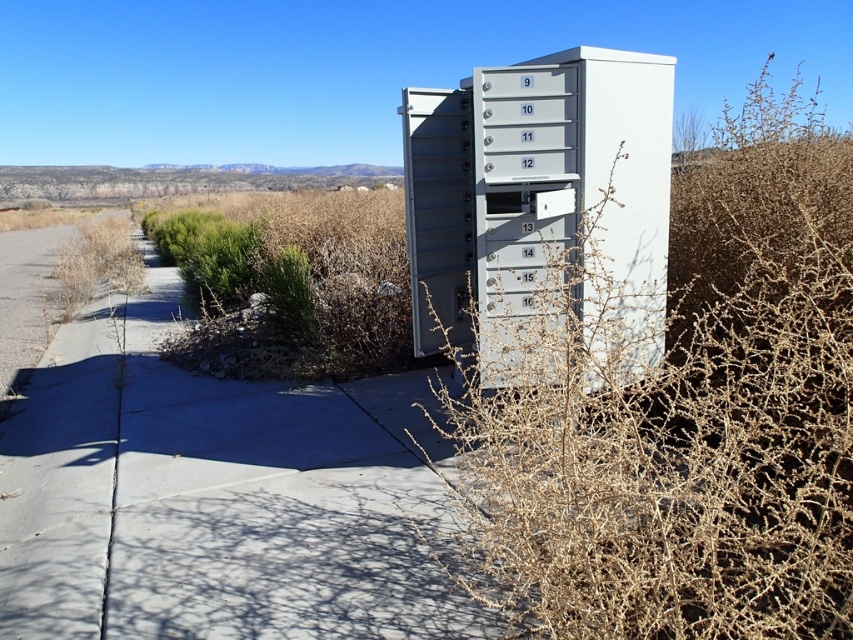
Question: Which point is farther to the camera?

Choices:
 (A) gray metallic file cabinet at center
 (B) gray concrete sidewalk at center
 (C) brown spiky bush at right

Answer: (B)

Question: Among these objects, which one is farthest from the camera?

Choices:
 (A) gray metallic file cabinet at center
 (B) gray concrete sidewalk at center

Answer: (B)

Question: Estimate the real-world distances between objects in this image. Which object is farther from the gray concrete sidewalk at center?

Choices:
 (A) gray metallic file cabinet at center
 (B) brown spiky bush at right

Answer: (B)

Question: Is gray concrete sidewalk at center wider than gray metallic file cabinet at center?

Choices:
 (A) no
 (B) yes

Answer: (B)

Question: Is gray concrete sidewalk at center further to camera compared to gray metallic file cabinet at center?

Choices:
 (A) no
 (B) yes

Answer: (B)

Question: Is gray concrete sidewalk at center further to camera compared to gray metallic file cabinet at center?

Choices:
 (A) no
 (B) yes

Answer: (B)